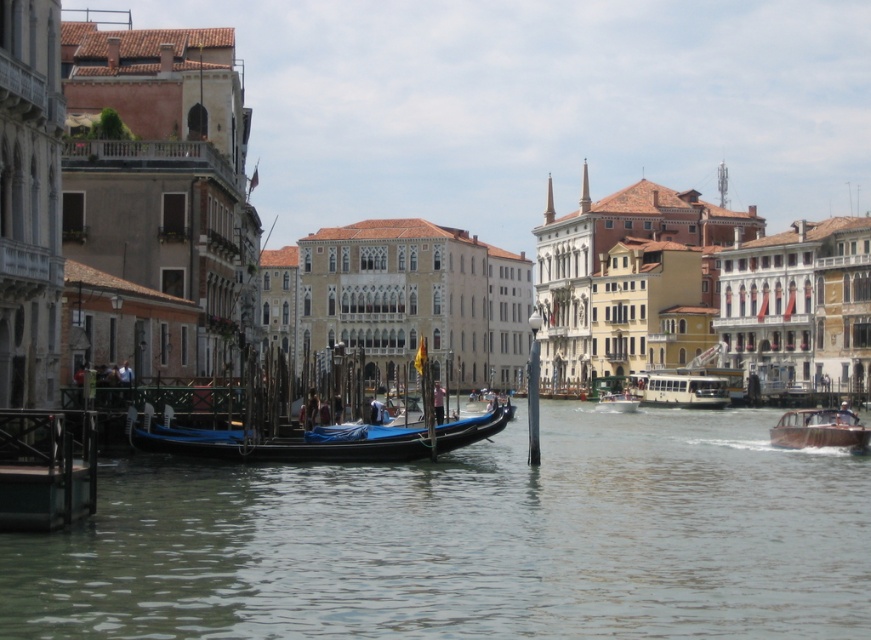
You are a tour guide in Venice and need to decide which vehicle to use for a short ride along the canal. The white glossy bus at center and the white plastic boat at center are both available. Which one is more suitable for navigating the narrow canal?

The white plastic boat at center is more suitable for navigating the narrow canal because it is smaller than the white glossy bus at center.

Looking at this image, you are a tourist standing on the wooden pier and want to take a photo of the wooden polished boat at right. To get the best reflection of the boat in the clear water at lower center, should you position yourself closer to the boat or further away?

The clear water at lower center might be wider than the wooden polished boat at right, so positioning yourself closer to the boat could help capture its reflection more prominently in the water.

You are taking a photo of the canal scene and want to focus on both point A at point (136, 445) and point B at point (788, 436). Which point is closer to your camera lens?

Point A at point (136, 445) is closer to the camera lens than point B at point (788, 436).